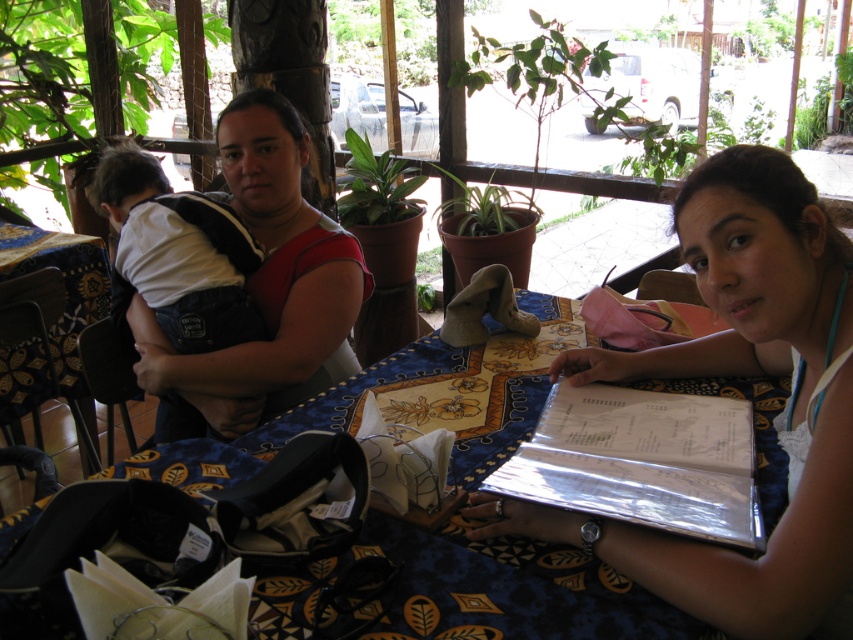
You are a customer at this outdoor restaurant and want to look at the menu while sitting on the denim overalls at left. Where should you look to find the metallic silver menu at lower right?

The metallic silver menu at lower right is located to the right of the denim overalls at left, so you should look to your right side to find it.

You are sitting at the table and want to grab the metallic silver menu at lower right and the denim overalls at left. Which one is easier to reach without moving your seat?

The metallic silver menu at lower right is closer to the viewer than the denim overalls at left, so it is easier to reach without moving your seat.